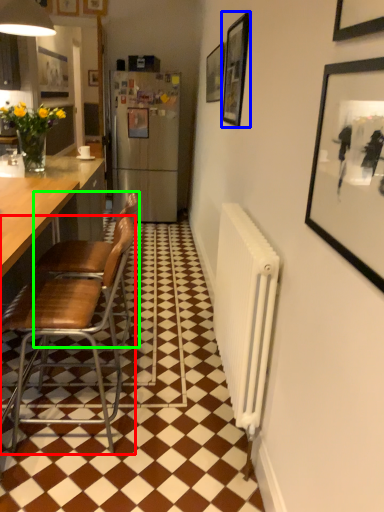
Question: Estimate the real-world distances between objects in this image. Which object is farther from chair (highlighted by a red box), picture frame (highlighted by a blue box) or chair (highlighted by a green box)?

Choices:
 (A) picture frame
 (B) chair

Answer: (A)